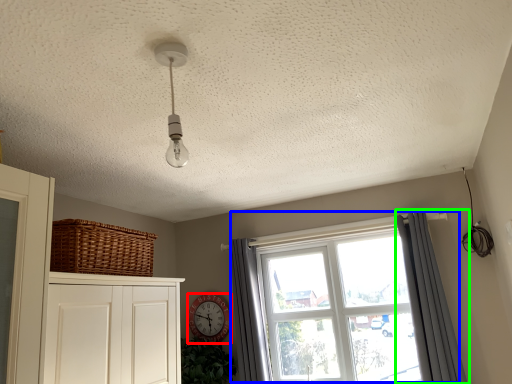
Question: Considering the real-world distances, which object is farthest from clock (highlighted by a red box)? window (highlighted by a blue box) or curtain (highlighted by a green box)?

Choices:
 (A) window
 (B) curtain

Answer: (B)